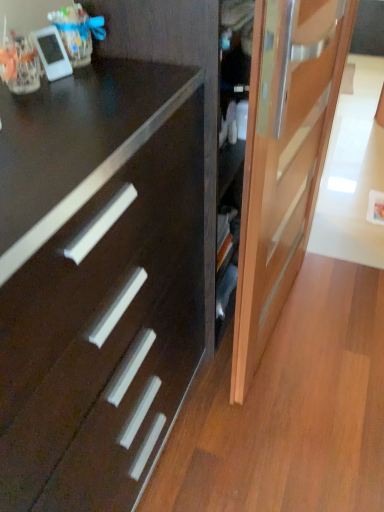
Question: Is point (185, 210) closer or farther from the camera than point (279, 39)?

Choices:
 (A) farther
 (B) closer

Answer: (A)

Question: Which is correct: dark wood drawer at center is inside light brown wooden door at right, or outside of it?

Choices:
 (A) inside
 (B) outside

Answer: (B)

Question: Is dark wood drawer at center wider or thinner than light brown wooden door at right?

Choices:
 (A) thin
 (B) wide

Answer: (B)

Question: Considering the positions of light brown wooden door at right and dark wood drawer at center in the image, is light brown wooden door at right taller or shorter than dark wood drawer at center?

Choices:
 (A) tall
 (B) short

Answer: (A)

Question: Considering the relative positions of light brown wooden door at right and dark wood drawer at center in the image provided, is light brown wooden door at right to the left or to the right of dark wood drawer at center?

Choices:
 (A) right
 (B) left

Answer: (A)

Question: In terms of size, does light brown wooden door at right appear bigger or smaller than dark wood drawer at center?

Choices:
 (A) small
 (B) big

Answer: (A)

Question: Does point tap(248, 234) appear closer or farther from the camera than point tap(119, 246)?

Choices:
 (A) farther
 (B) closer

Answer: (A)